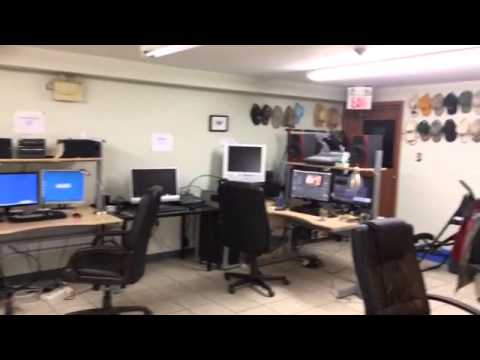
Identify the location of cords. (63, 250), (37, 256), (25, 281), (199, 175), (199, 187), (341, 269).